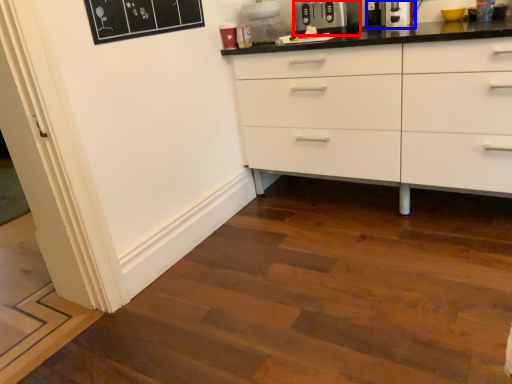
Question: Among these objects, which one is nearest to the camera, appliance (highlighted by a red box) or coffee machine (highlighted by a blue box)?

Choices:
 (A) appliance
 (B) coffee machine

Answer: (B)